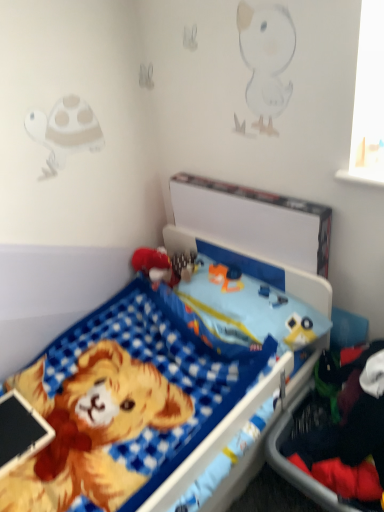
Locate an element on the screen. The image size is (384, 512). vacant region above dark blue fabric at lower right (from a real-world perspective) is located at coordinates (334, 438).